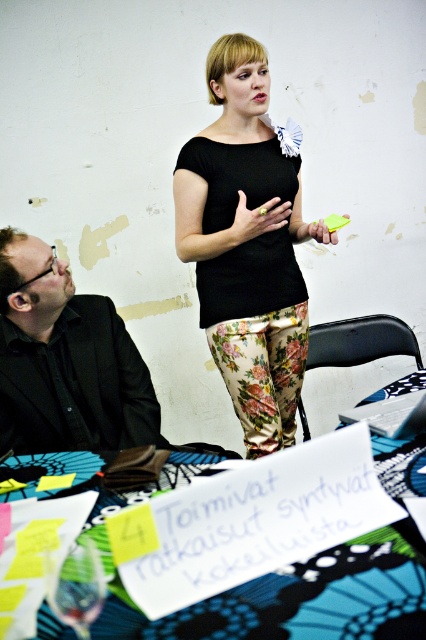
You are a photographer setting up for a portrait. You need to position a light source to the left of the black shirt at left and to the right of the transparent glass at lower left. Is this possible based on the scene?

The black shirt at left is positioned on the left side of transparent glass at lower left. Therefore, placing the light source to the left of the black shirt at left and to the right of the transparent glass at lower left is not possible because the black shirt is already to the left of the glass, meaning the glass is to the right of the shirt. The light source cannot be both left of the shirt and right of the glass if they are arranged in this order.

What is the 2D coordinate of the black shirt at left?

The black shirt at left is located at the 2D coordinate point of (66, 362).

From the picture: You are organizing a small event and need to place a 1.5 meter long banner between the blue printed fabric table at lower center and the black shirt at left. Is there enough space between them to fit the banner?

The blue printed fabric table at lower center has a smaller size compared to black shirt at left, but the description does not provide information about the distance between them. Therefore, it is impossible to determine if the banner will fit based on the given details.